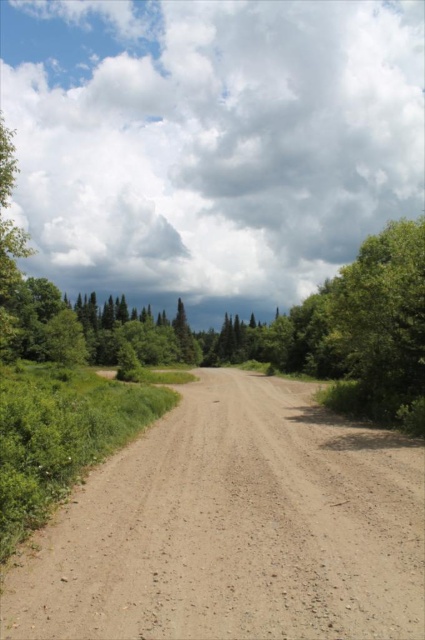
You are standing on the rural dirt road and see two points marked on the ground. The first point is at coordinate point [155,429] and the second is at point [388,259]. Which point is closer to you?

Point [155,429] is closer to the viewer than point [388,259].